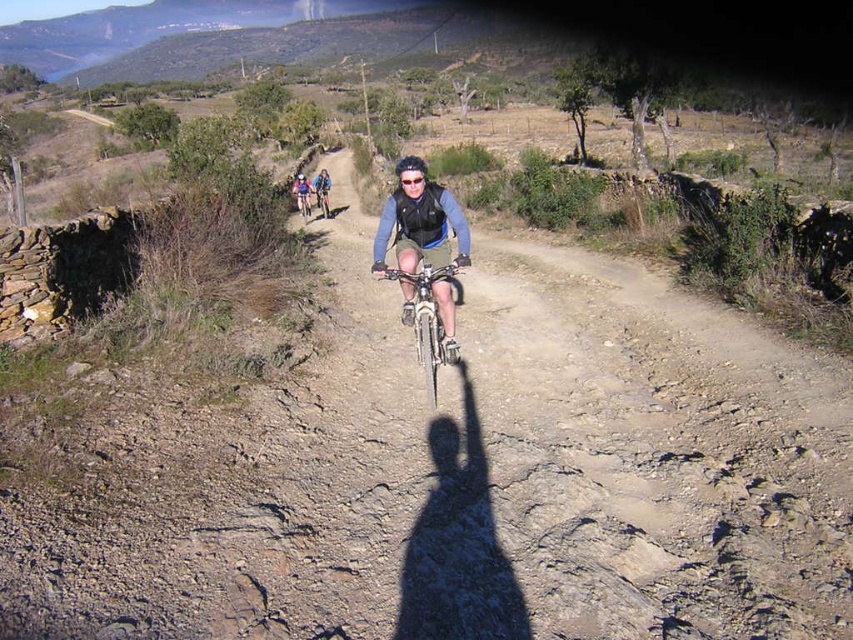
Question: Can you confirm if silver metallic bicycle at center is positioned above transparent plastic goggles at center?

Choices:
 (A) yes
 (B) no

Answer: (B)

Question: Can you confirm if silver metallic bicycle at center is bigger than transparent plastic goggles at center?

Choices:
 (A) no
 (B) yes

Answer: (B)

Question: Among these objects, which one is nearest to the camera?

Choices:
 (A) transparent plastic goggles at center
 (B) silver metallic bicycle at center

Answer: (B)

Question: Which point is closer to the camera?

Choices:
 (A) (415, 333)
 (B) (415, 179)

Answer: (B)

Question: In this image, where is silver metallic bicycle at center located relative to transparent plastic goggles at center?

Choices:
 (A) below
 (B) above

Answer: (A)